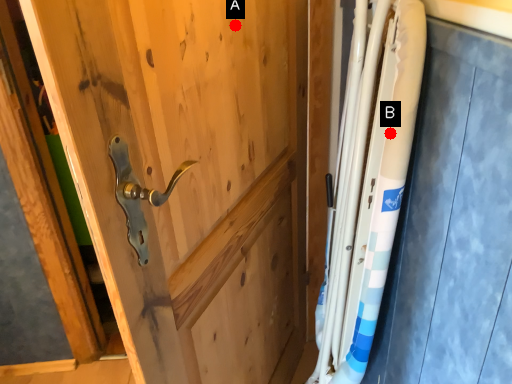
Question: Two points are circled on the image, labeled by A and B beside each circle. Which of the following is the farthest from the observer?

Choices:
 (A) A is further
 (B) B is further

Answer: (A)